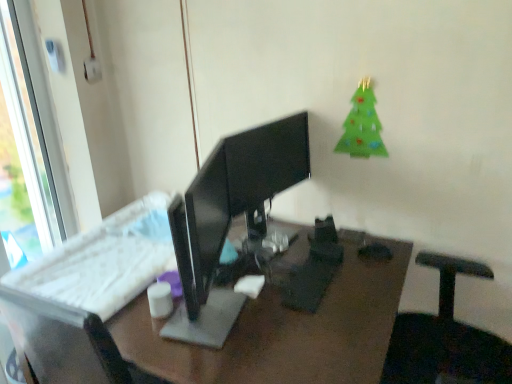
Question: Does white matte cup at center have a greater height compared to black glossy monitor at center?

Choices:
 (A) no
 (B) yes

Answer: (A)

Question: From the image's perspective, is white matte cup at center over black glossy monitor at center?

Choices:
 (A) no
 (B) yes

Answer: (A)

Question: Does white matte cup at center turn towards black glossy monitor at center?

Choices:
 (A) no
 (B) yes

Answer: (A)

Question: Are white matte cup at center and black glossy monitor at center making contact?

Choices:
 (A) no
 (B) yes

Answer: (A)

Question: From the image's perspective, is white matte cup at center located beneath black glossy monitor at center?

Choices:
 (A) yes
 (B) no

Answer: (A)

Question: From their relative heights in the image, would you say green felt christmas tree at upper right is taller or shorter than white plastic window at left?

Choices:
 (A) short
 (B) tall

Answer: (A)

Question: From the image's perspective, is green felt christmas tree at upper right above or below white plastic window at left?

Choices:
 (A) below
 (B) above

Answer: (B)

Question: From a real-world perspective, relative to white plastic window at left, is green felt christmas tree at upper right vertically above or below?

Choices:
 (A) below
 (B) above

Answer: (B)

Question: Considering the positions of point (379, 147) and point (26, 66), is point (379, 147) closer or farther from the camera than point (26, 66)?

Choices:
 (A) farther
 (B) closer

Answer: (B)

Question: Considering the positions of white matte cup at center and white plastic keyboard at center in the image, is white matte cup at center bigger or smaller than white plastic keyboard at center?

Choices:
 (A) small
 (B) big

Answer: (A)

Question: In terms of width, does white matte cup at center look wider or thinner when compared to white plastic keyboard at center?

Choices:
 (A) thin
 (B) wide

Answer: (A)

Question: Considering the positions of point (166, 312) and point (359, 372), is point (166, 312) closer or farther from the camera than point (359, 372)?

Choices:
 (A) farther
 (B) closer

Answer: (A)

Question: In the image, is white matte cup at center positioned in front of or behind white plastic keyboard at center?

Choices:
 (A) front
 (B) behind

Answer: (B)

Question: From their relative heights in the image, would you say black glossy monitor at center is taller or shorter than white plastic window at left?

Choices:
 (A) tall
 (B) short

Answer: (B)

Question: Is black glossy monitor at center bigger or smaller than white plastic window at left?

Choices:
 (A) big
 (B) small

Answer: (A)